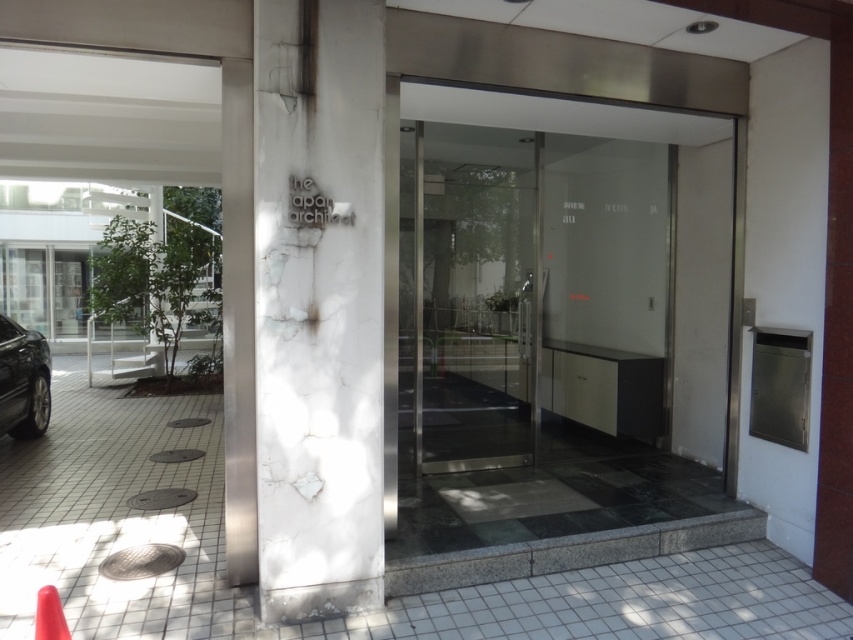
The height and width of the screenshot is (640, 853). What do you see at coordinates (318, 305) in the screenshot? I see `white marble pillar at center` at bounding box center [318, 305].

Is point (280, 193) less distant than point (41, 605)?

That is False.

Is point (375, 531) closer to viewer compared to point (59, 609)?

No, it is not.

At what (x,y) coordinates should I click in order to perform the action: click on white marble pillar at center. Please return your answer as a coordinate pair (x, y). The width and height of the screenshot is (853, 640). Looking at the image, I should click on (318, 305).

Who is higher up, white marble pillar at center or transparent glass door at center?

Positioned higher is white marble pillar at center.

Where is `white marble pillar at center`? white marble pillar at center is located at coordinates (318, 305).

Is point (376, 461) more distant than point (427, 237)?

No, it is in front of (427, 237).

What are the coordinates of `white marble pillar at center` in the screenshot? It's located at (318, 305).

Is transparent glass door at center above shiny black car at lower left?

Incorrect, transparent glass door at center is not positioned above shiny black car at lower left.

Is transparent glass door at center wider than shiny black car at lower left?

Yes, transparent glass door at center is wider than shiny black car at lower left.

Which is in front, point (496, 397) or point (3, 394)?

Point (3, 394) is more forward.

What are the coordinates of `transparent glass door at center` in the screenshot? It's located at (473, 296).